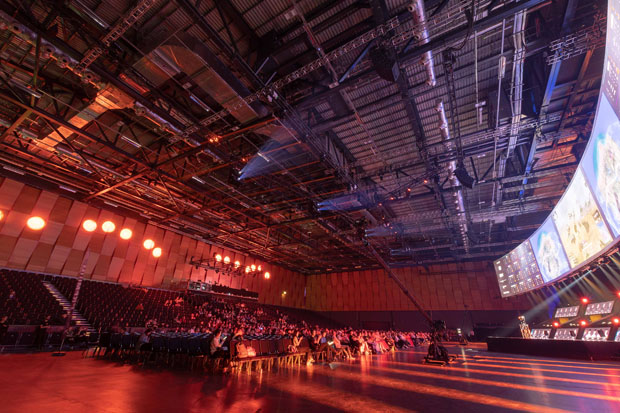
Locate an element on the screen. This screenshot has height=413, width=620. orange light under screen is located at coordinates (552, 324), (586, 320), (583, 300), (614, 295), (614, 321).